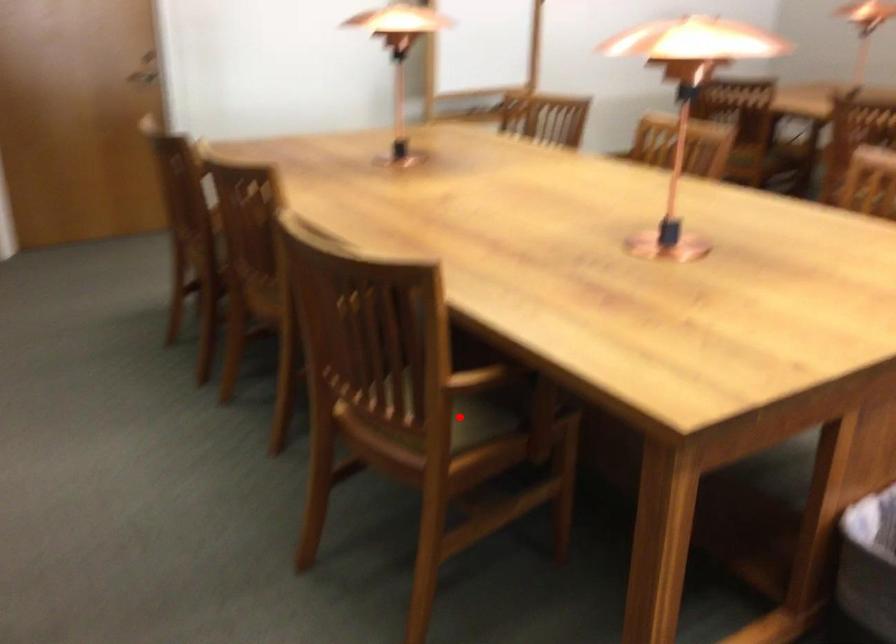
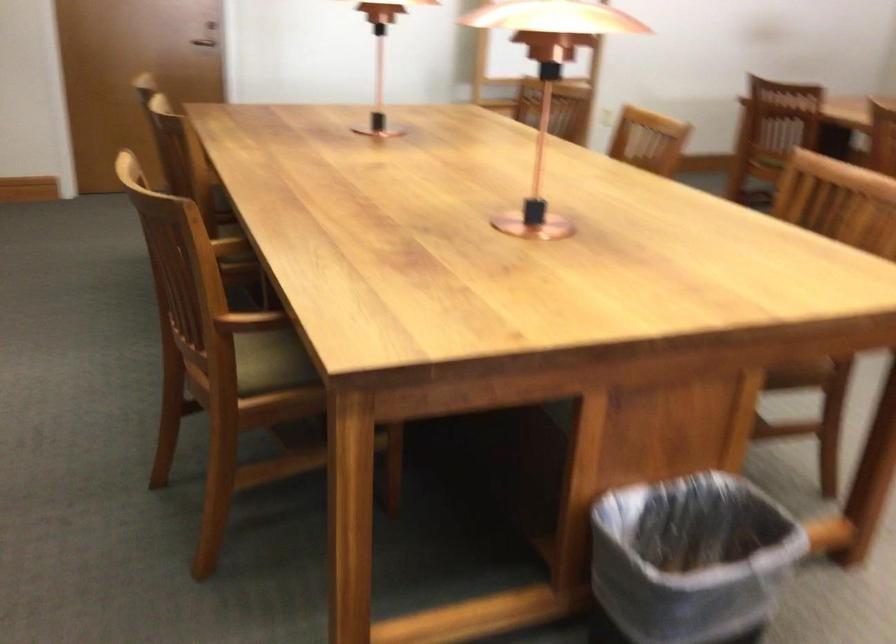
Where in the second image is the point corresponding to the highlighted location from the first image?

(271, 362)